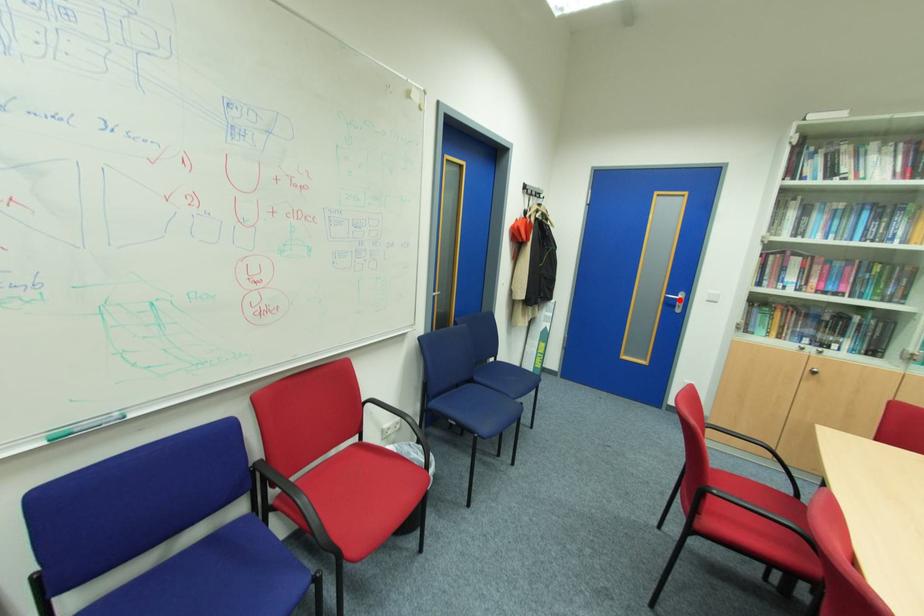
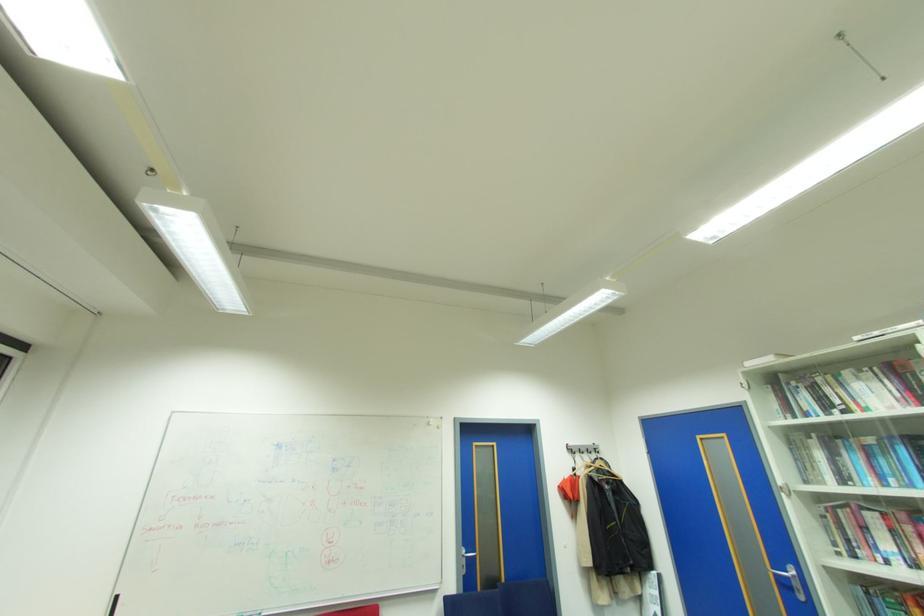
Where in the second image is the point corresponding to the highlighted location from the first image?

(791, 578)